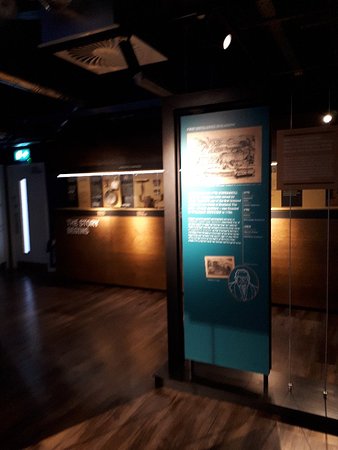
This screenshot has width=338, height=450. What are the coordinates of `display plate` in the screenshot? It's located at (110, 196).